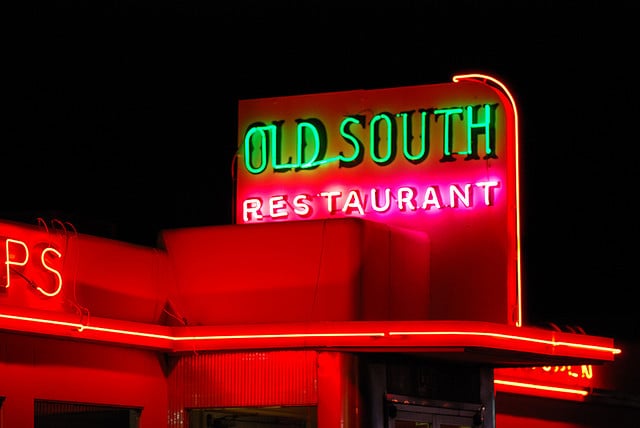
Locate an element on the screen. front wall is located at coordinates (93, 374), (237, 379).